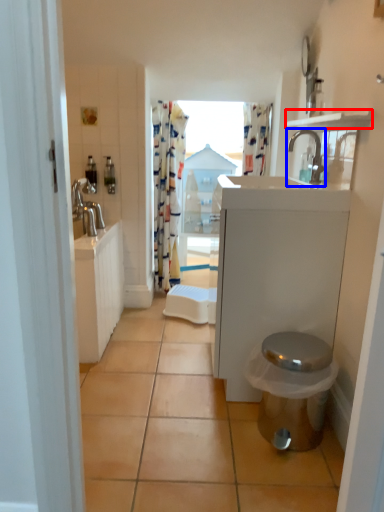
Question: Among these objects, which one is farthest to the camera, balustrade (highlighted by a red box) or tap (highlighted by a blue box)?

Choices:
 (A) balustrade
 (B) tap

Answer: (B)